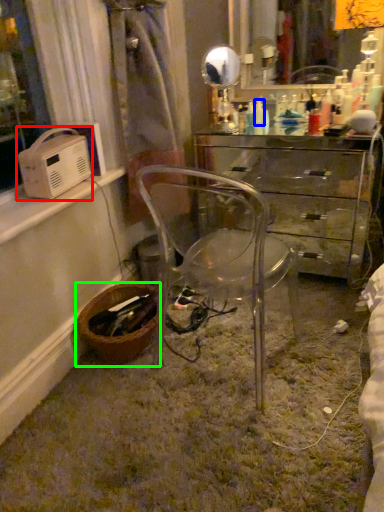
Question: Based on their relative distances, which object is farther from appliance (highlighted by a red box)? Choose from toiletry (highlighted by a blue box) and basket (highlighted by a green box).

Choices:
 (A) toiletry
 (B) basket

Answer: (A)